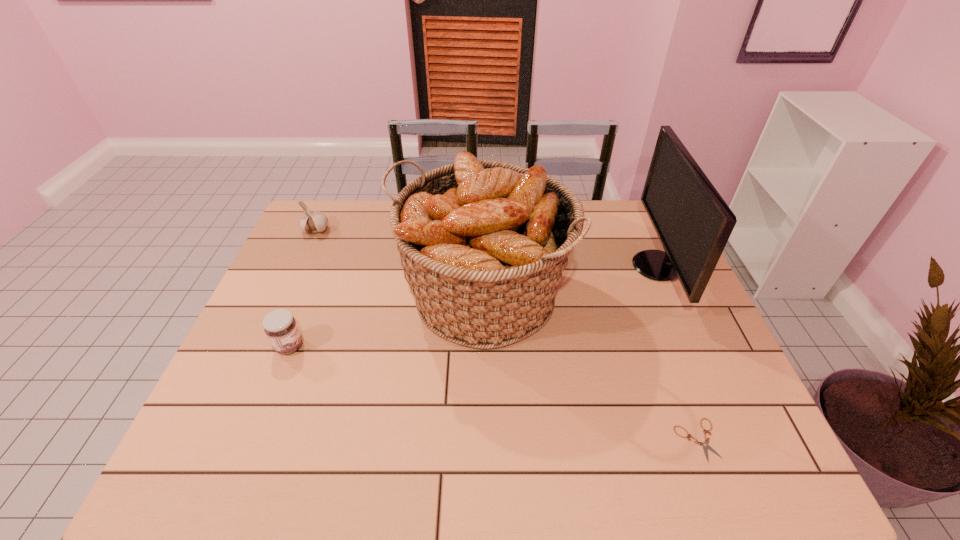
Find the location of a particular element. The image size is (960, 540). vacant space located on the front of the garlic is located at coordinates (279, 312).

Where is `free region located on the front label of the jam`? free region located on the front label of the jam is located at coordinates (327, 346).

The height and width of the screenshot is (540, 960). In order to click on free region located 0.100m on the back of the shears in this screenshot , I will do `click(675, 380)`.

I want to click on computer monitor at the far edge, so click(x=693, y=223).

Where is `garlic that is positioned at the far edge`? Image resolution: width=960 pixels, height=540 pixels. garlic that is positioned at the far edge is located at coordinates (312, 222).

Identify the location of object that is at the near edge. (705, 445).

This screenshot has width=960, height=540. What are the coordinates of `garlic that is at the left edge` in the screenshot? It's located at (312, 222).

Identify the location of jam that is at the left edge. (280, 326).

At what (x,y) coordinates should I click in order to perform the action: click on computer monitor that is at the right edge. Please return your answer as a coordinate pair (x, y). The height and width of the screenshot is (540, 960). Looking at the image, I should click on (693, 223).

Identify the location of shears that is at the right edge. The width and height of the screenshot is (960, 540). (705, 445).